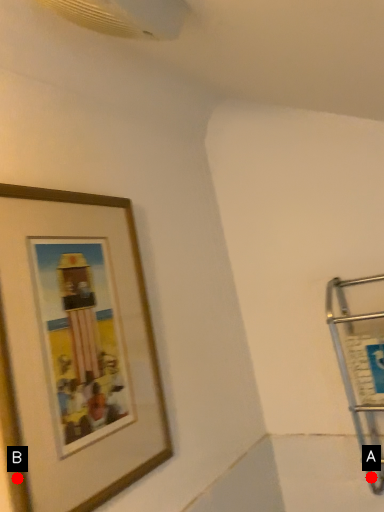
Question: Two points are circled on the image, labeled by A and B beside each circle. Among these points, which one is farthest from the camera?

Choices:
 (A) A is further
 (B) B is further

Answer: (A)